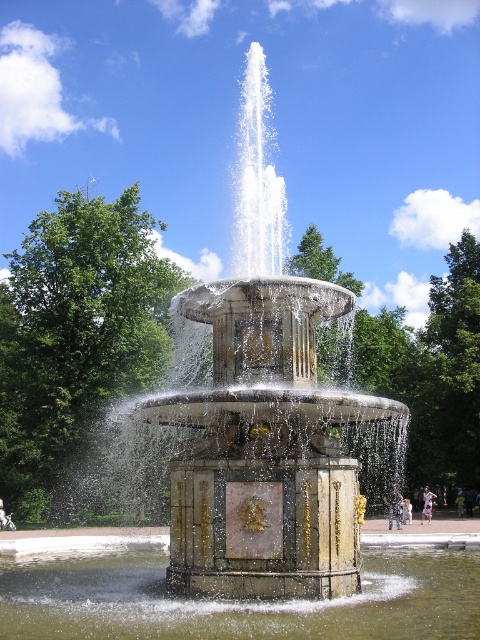
Is white marble fountain at center positioned at the back of clear water at fountain center?

Yes.

Does white marble fountain at center appear over clear water at fountain center?

Correct, white marble fountain at center is located above clear water at fountain center.

I want to click on white marble fountain at center, so click(253, 417).